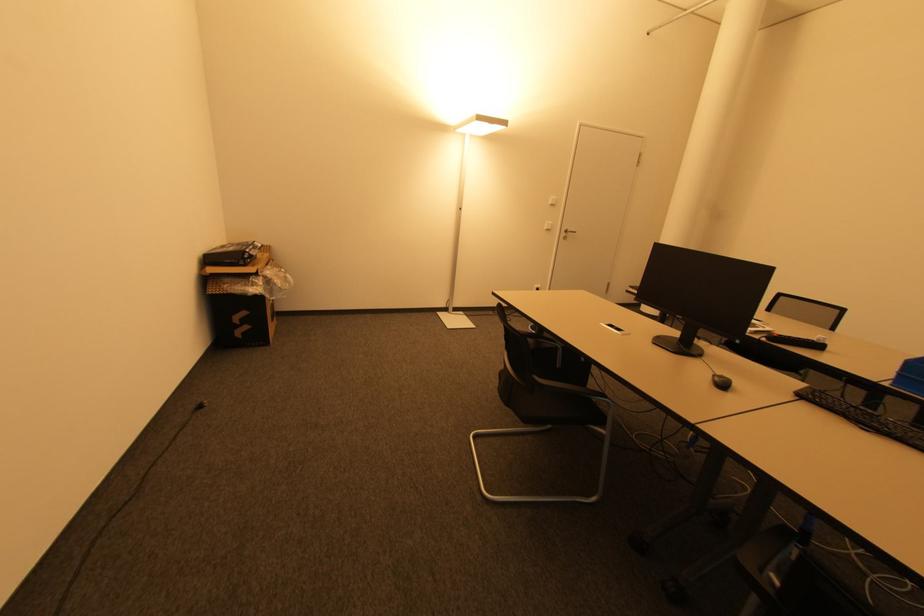
What do you see at coordinates (566, 233) in the screenshot? The image size is (924, 616). I see `the silver door handle` at bounding box center [566, 233].